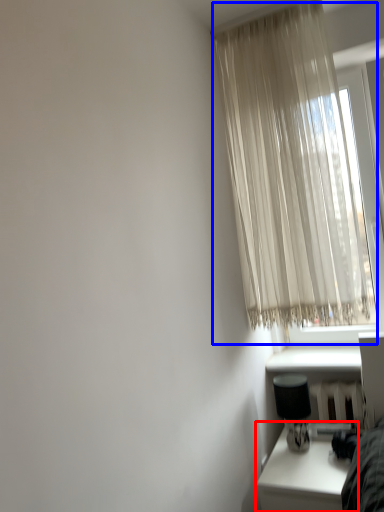
Question: Which object appears closest to the camera in this image, table (highlighted by a red box) or curtain (highlighted by a blue box)?

Choices:
 (A) table
 (B) curtain

Answer: (A)